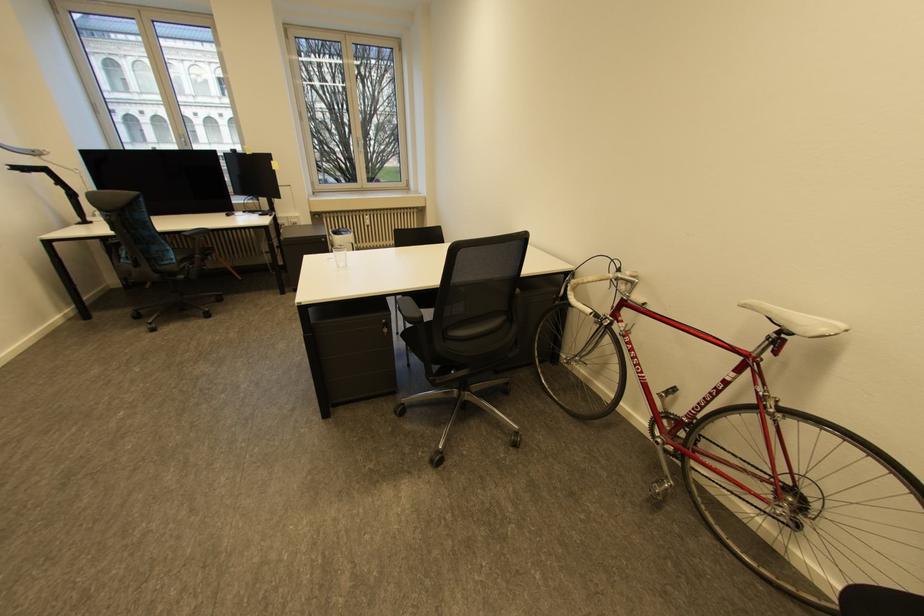
Image resolution: width=924 pixels, height=616 pixels. What do you see at coordinates (360, 144) in the screenshot?
I see `the white window handle` at bounding box center [360, 144].